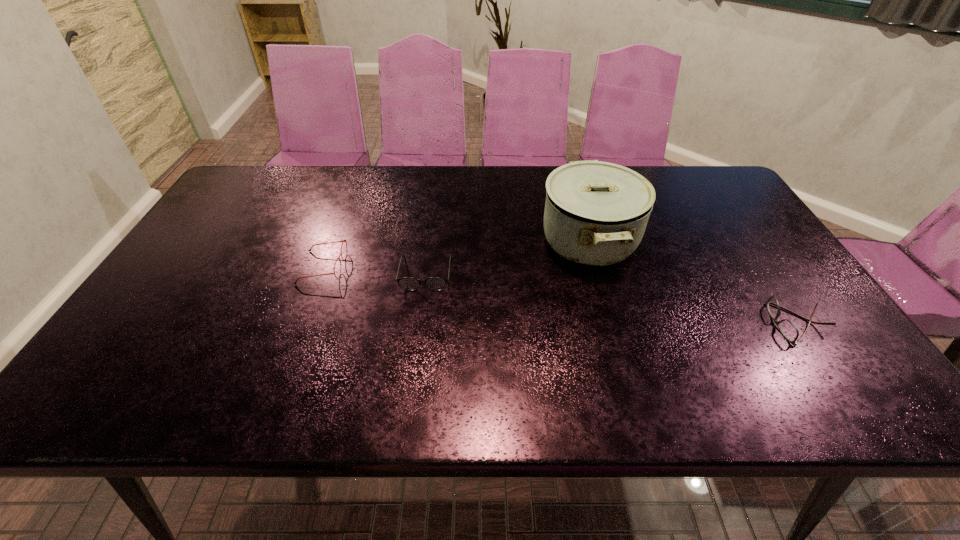
Locate an element on the screen. the tallest object is located at coordinates (596, 213).

Find the location of `saucepan`. saucepan is located at coordinates [596, 213].

You are a GUI agent. You are given a task and a screenshot of the screen. Output one action in this format:
    pyautogui.click(x=<x>, y=<y>)
    Task: Click on the leftmost object
    The image size is (960, 540).
    Given the screenshot: What is the action you would take?
    pyautogui.click(x=344, y=240)

Locate an element on the screen. Image resolution: width=960 pixels, height=540 pixels. the second spectacles from right to left is located at coordinates (408, 283).

You are a GUI agent. You are given a task and a screenshot of the screen. Output one action in this format:
    pyautogui.click(x=<x>, y=<y>)
    Task: Click on the shortest object
    The image size is (960, 540).
    Given the screenshot: What is the action you would take?
    pyautogui.click(x=787, y=328)

Find the location of a particular element. The width and height of the screenshot is (960, 540). the shortest spectacles is located at coordinates (787, 328).

Identify the location of vacant space located on the right of the second object from right to left. click(x=673, y=240).

Find the location of a particular element. The height and width of the screenshot is (540, 960). vacant space situated 0.120m on the face of the leftmost spectacles is located at coordinates (389, 267).

This screenshot has height=540, width=960. Identify the location of blank space located 0.250m on the front-facing side of the third object from right to left. (413, 377).

Identify the location of vacant space located 0.180m on the front-facing side of the nearest object. (697, 323).